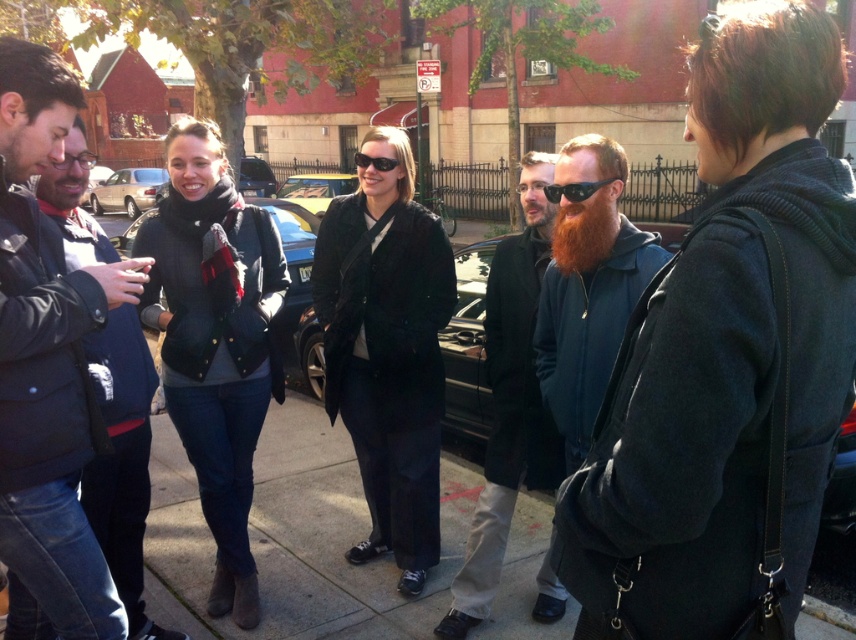
Question: Can you confirm if dark gray coat at center is positioned above black plastic sunglasses at center?

Choices:
 (A) no
 (B) yes

Answer: (A)

Question: Estimate the real-world distances between objects in this image. Which object is farther from the gold metallic sedan at left?

Choices:
 (A) dark blue fleece jacket at center
 (B) reddish-brown beard at center
 (C) orange fuzzy beard at center
 (D) matte black coat at center

Answer: (B)

Question: Which point appears closest to the camera in this image?

Choices:
 (A) (710, 428)
 (B) (512, 563)
 (C) (360, 204)

Answer: (A)

Question: Is reddish-brown beard at center behind black plastic sunglasses at center?

Choices:
 (A) yes
 (B) no

Answer: (B)

Question: Which of these objects is positioned closest to the reddish-brown beard at center?

Choices:
 (A) dark blue puffer jacket at left
 (B) black plastic sunglasses at center

Answer: (B)

Question: Can you confirm if matte black coat at center is wider than leather jacket at center?

Choices:
 (A) yes
 (B) no

Answer: (A)